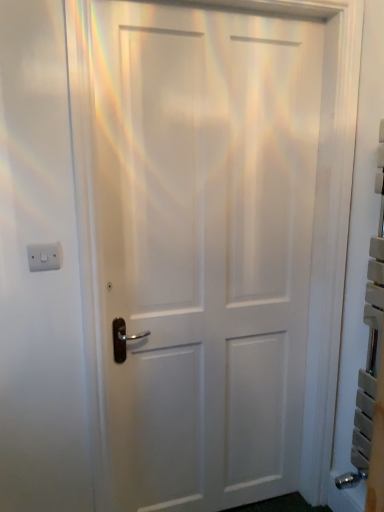
Measure the distance between white plastic/light switch at upper left and camera.

The depth of white plastic/light switch at upper left is 1.27 meters.

What do you see at coordinates (44, 256) in the screenshot? Image resolution: width=384 pixels, height=512 pixels. I see `white plastic/light switch at upper left` at bounding box center [44, 256].

Image resolution: width=384 pixels, height=512 pixels. Identify the location of white plastic/light switch at upper left. (44, 256).

What do you see at coordinates (202, 249) in the screenshot? I see `white matte door at center` at bounding box center [202, 249].

In order to click on white matte door at center in this screenshot , I will do `click(202, 249)`.

Locate an element on the screen. This screenshot has height=512, width=384. white plastic/light switch at upper left is located at coordinates (44, 256).

Considering the positions of objects white plastic/light switch at upper left and white matte door at center in the image provided, who is more to the left, white plastic/light switch at upper left or white matte door at center?

Positioned to the left is white plastic/light switch at upper left.

Is white plastic/light switch at upper left closer to camera compared to white matte door at center?

No.

Is point (38, 244) positioned behind point (280, 447)?

No.

From the image's perspective, would you say white plastic/light switch at upper left is shown under white matte door at center?

Incorrect, from the image's perspective, white plastic/light switch at upper left is higher than white matte door at center.

From a real-world perspective, does white plastic/light switch at upper left stand above white matte door at center?

Indeed, from a real-world perspective, white plastic/light switch at upper left stands above white matte door at center.

Considering the relative sizes of white plastic/light switch at upper left and white matte door at center in the image provided, is white plastic/light switch at upper left wider than white matte door at center?

In fact, white plastic/light switch at upper left might be narrower than white matte door at center.

Is white plastic/light switch at upper left taller or shorter than white matte door at center?

Clearly, white plastic/light switch at upper left is shorter compared to white matte door at center.

Which of these two, white plastic/light switch at upper left or white matte door at center, is bigger?

With larger size is white matte door at center.

Is white plastic/light switch at upper left spatially inside white matte door at center, or outside of it?

white plastic/light switch at upper left is not inside white matte door at center, it's outside.

Is white plastic/light switch at upper left next to white matte door at center and touching it?

white plastic/light switch at upper left and white matte door at center are not in contact.

Does white plastic/light switch at upper left turn towards white matte door at center?

No.

How much distance is there between white plastic/light switch at upper left and white matte door at center?

The distance of white plastic/light switch at upper left from white matte door at center is 27.24 inches.

Where is `light switch on the left of white matte door at center`? The height and width of the screenshot is (512, 384). light switch on the left of white matte door at center is located at coordinates (44, 256).

Considering the positions of objects white matte door at center and white plastic/light switch at upper left in the image provided, who is more to the right, white matte door at center or white plastic/light switch at upper left?

Positioned to the right is white matte door at center.

Is white matte door at center positioned before white plastic/light switch at upper left?

Yes.

Between point (169, 321) and point (50, 246), which one is positioned behind?

The point (169, 321) is behind.

From the image's perspective, which object appears higher, white matte door at center or white plastic/light switch at upper left?

white plastic/light switch at upper left appears higher in the image.

From a real-world perspective, relative to white plastic/light switch at upper left, is white matte door at center vertically above or below?

white matte door at center is below white plastic/light switch at upper left.

Which of these two, white matte door at center or white plastic/light switch at upper left, is thinner?

Thinner between the two is white plastic/light switch at upper left.

In terms of height, does white matte door at center look taller or shorter compared to white plastic/light switch at upper left?

Clearly, white matte door at center is taller compared to white plastic/light switch at upper left.

Who is smaller, white matte door at center or white plastic/light switch at upper left?

white plastic/light switch at upper left.

Is white matte door at center inside or outside of white plastic/light switch at upper left?

white matte door at center is located beyond the bounds of white plastic/light switch at upper left.

Is white matte door at center placed right next to white plastic/light switch at upper left?

No, white matte door at center is not beside white plastic/light switch at upper left.

Is white matte door at center oriented towards white plastic/light switch at upper left?

No, white matte door at center is not turned towards white plastic/light switch at upper left.

In the scene shown: How many degrees apart are the facing directions of white matte door at center and white plastic/light switch at upper left?

There is a 3.34-degree angle between the facing directions of white matte door at center and white plastic/light switch at upper left.

Where is `door below the white plastic/light switch at upper left (from the image's perspective)`? Image resolution: width=384 pixels, height=512 pixels. door below the white plastic/light switch at upper left (from the image's perspective) is located at coordinates (202, 249).

Where is `door that appears in front of the white plastic/light switch at upper left`? door that appears in front of the white plastic/light switch at upper left is located at coordinates (202, 249).

Find the location of a particular element. The image size is (384, 512). door on the right of white plastic/light switch at upper left is located at coordinates (202, 249).